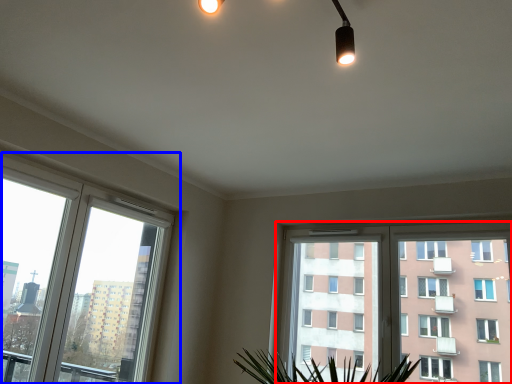
Question: Which object appears farthest to the camera in this image, window (highlighted by a red box) or window (highlighted by a blue box)?

Choices:
 (A) window
 (B) window

Answer: (A)